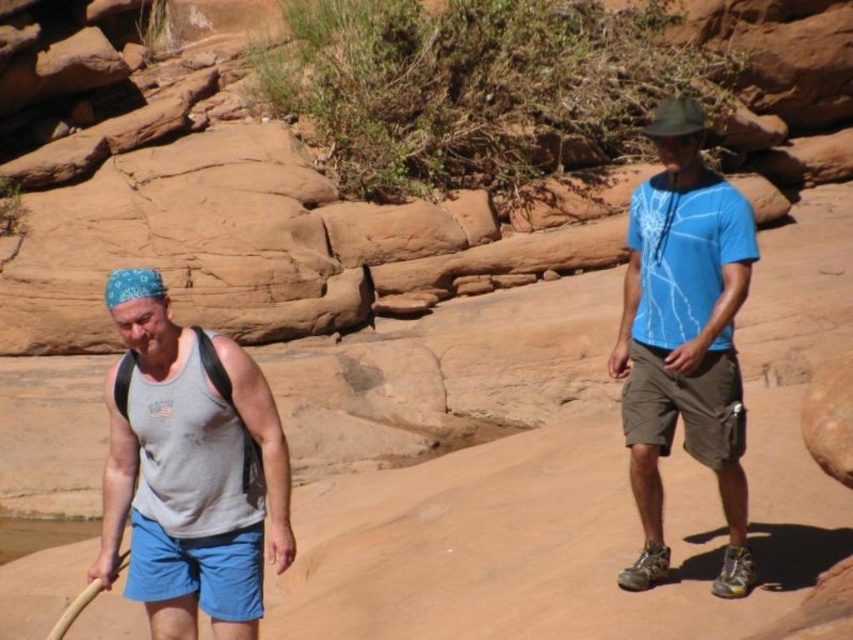
Question: Does gray cotton tank top at left come in front of blue matte t-shirt at center?

Choices:
 (A) no
 (B) yes

Answer: (B)

Question: Can you confirm if gray cotton tank top at left is thinner than blue matte t-shirt at center?

Choices:
 (A) no
 (B) yes

Answer: (A)

Question: Is gray cotton tank top at left closer to camera compared to blue matte t-shirt at center?

Choices:
 (A) no
 (B) yes

Answer: (B)